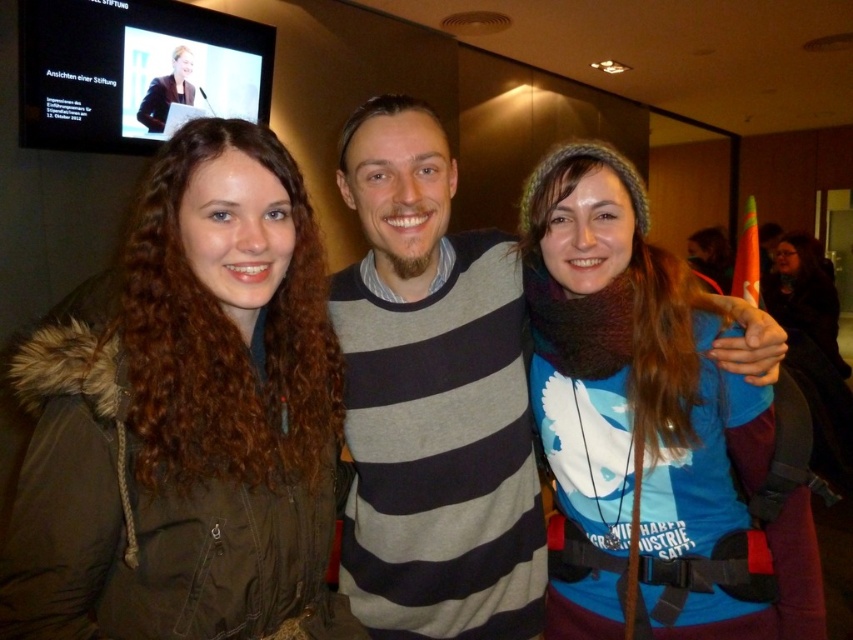
Is striped sweater at center below matte black jacket at upper left?

Yes.

Who is positioned more to the right, striped sweater at center or matte black jacket at upper left?

From the viewer's perspective, striped sweater at center appears more on the right side.

The width and height of the screenshot is (853, 640). What do you see at coordinates (432, 397) in the screenshot?
I see `striped sweater at center` at bounding box center [432, 397].

Image resolution: width=853 pixels, height=640 pixels. I want to click on striped sweater at center, so click(x=432, y=397).

Is dark brown fur-lined jacket at center to the left of striped sweater at center from the viewer's perspective?

Indeed, dark brown fur-lined jacket at center is positioned on the left side of striped sweater at center.

Is point (102, 369) positioned before point (497, 547)?

Yes.

The image size is (853, 640). I want to click on dark brown fur-lined jacket at center, so click(183, 432).

Is dark brown fur-lined jacket at center above matte black jacket at upper left?

Incorrect, dark brown fur-lined jacket at center is not positioned above matte black jacket at upper left.

Can you confirm if dark brown fur-lined jacket at center is bigger than matte black jacket at upper left?

Correct, dark brown fur-lined jacket at center is larger in size than matte black jacket at upper left.

Is point (9, 616) farther from viewer compared to point (155, 120)?

That is False.

Image resolution: width=853 pixels, height=640 pixels. I want to click on dark brown fur-lined jacket at center, so click(x=183, y=432).